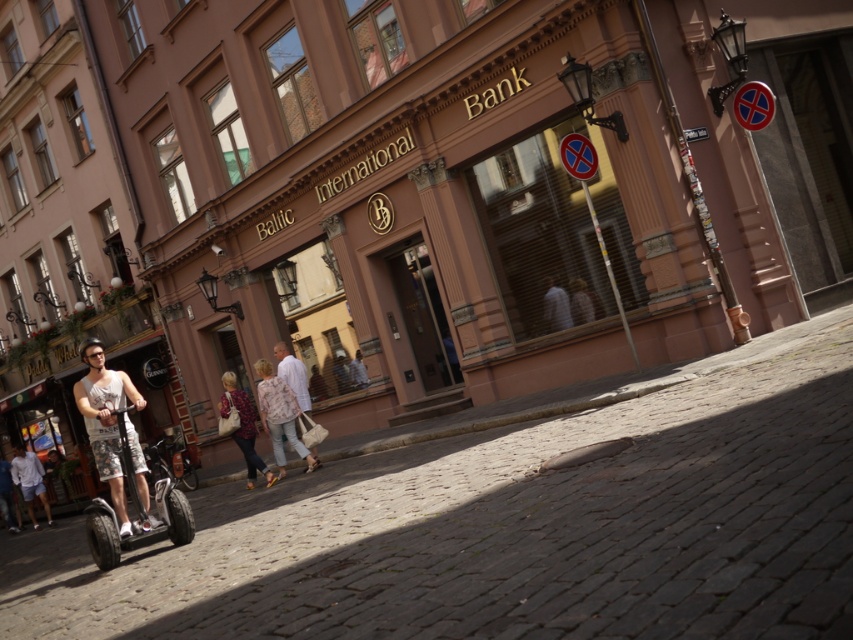
Question: Which point is farther to the camera?

Choices:
 (A) light gray shirt at center
 (B) cobblestone pavement at lower center
 (C) light pink fabric jacket at center

Answer: (A)

Question: Is floral-patterned fabric bag at center smaller than light blue denim shorts at lower left?

Choices:
 (A) no
 (B) yes

Answer: (B)

Question: Is silver metallic scooter at lower left further to the viewer compared to smooth beige shirt at center?

Choices:
 (A) no
 (B) yes

Answer: (A)

Question: Which of these objects is positioned farthest from the cobblestone pavement at lower center?

Choices:
 (A) light gray shirt at center
 (B) white cotton tank top at center
 (C) smooth beige shirt at center
 (D) white cotton shorts at lower left

Answer: (D)

Question: Which object appears closest to the camera in this image?

Choices:
 (A) silver metallic scooter at lower left
 (B) floral-patterned fabric bag at center
 (C) cobblestone pavement at lower center
 (D) white cotton tank top at center

Answer: (C)

Question: Does silver metallic scooter at lower left come in front of light brown leather jacket at center?

Choices:
 (A) no
 (B) yes

Answer: (B)